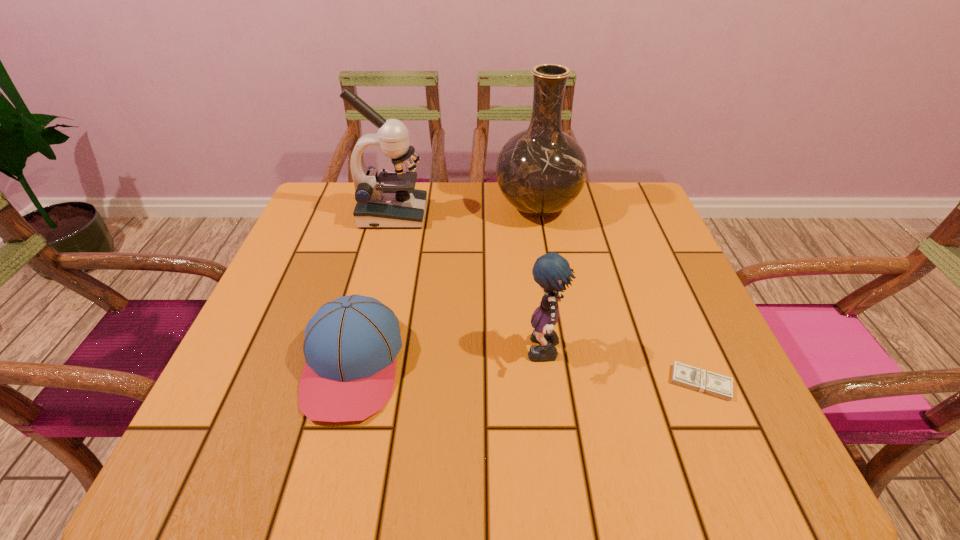
Locate an element on the screen. This screenshot has height=540, width=960. free space that satisfies the following two spatial constraints: 1. on the front-facing side of the rag doll; 2. on the back side of the shortest object is located at coordinates (548, 382).

Identify the location of free space that satisfies the following two spatial constraints: 1. on the front-facing side of the second shortest object; 2. on the right side of the money. (348, 382).